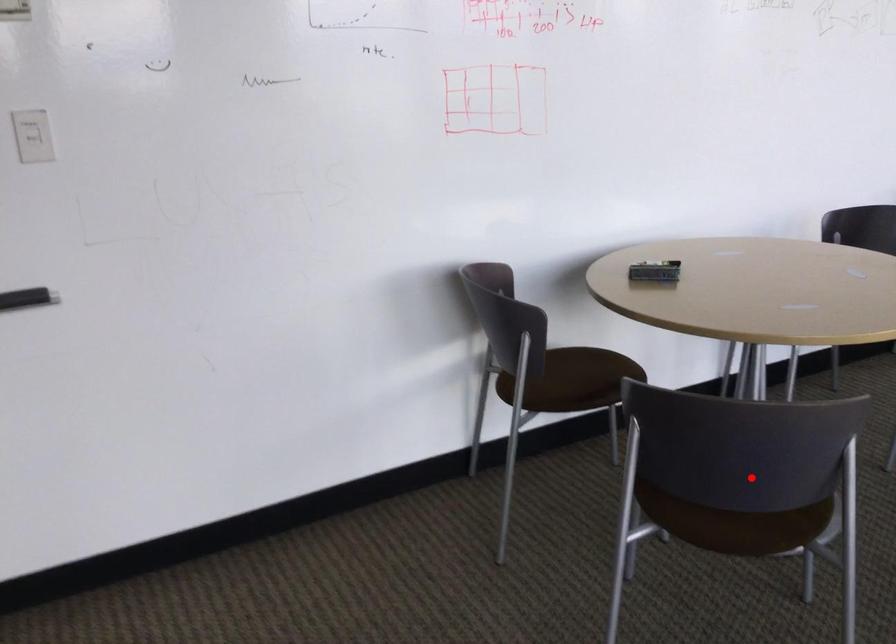
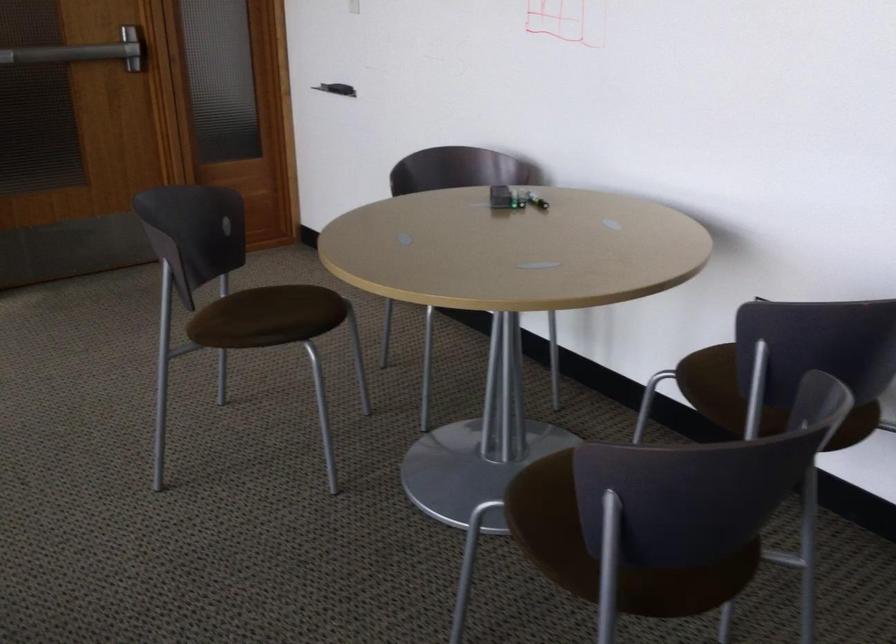
Question: I am providing you with two images of the same scene from different viewpoints. Image1 has a red point marked. In image2, the corresponding 3D location appears at what relative position? Reply with the corresponding letter.

Choices:
 (A) Closer
 (B) Farther

Answer: (B)